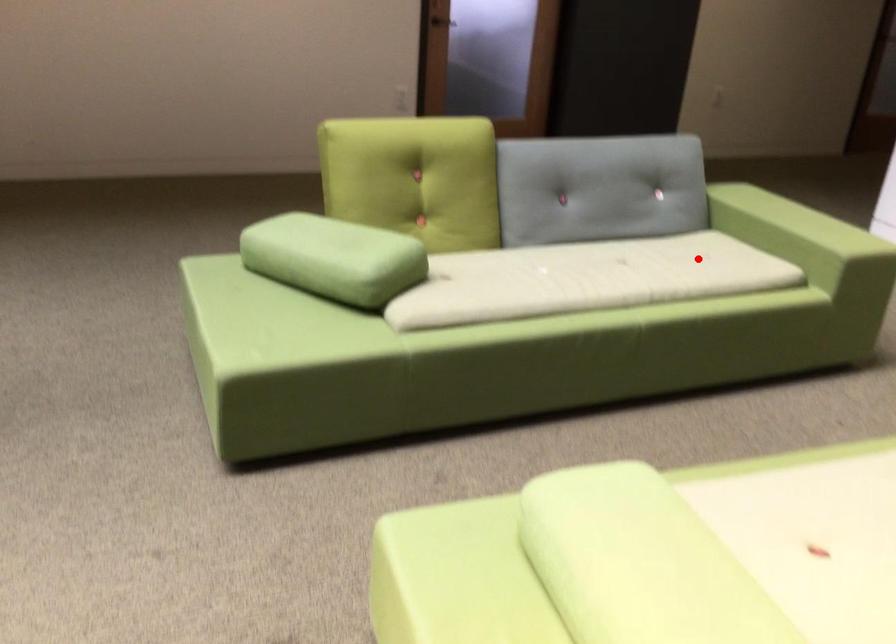
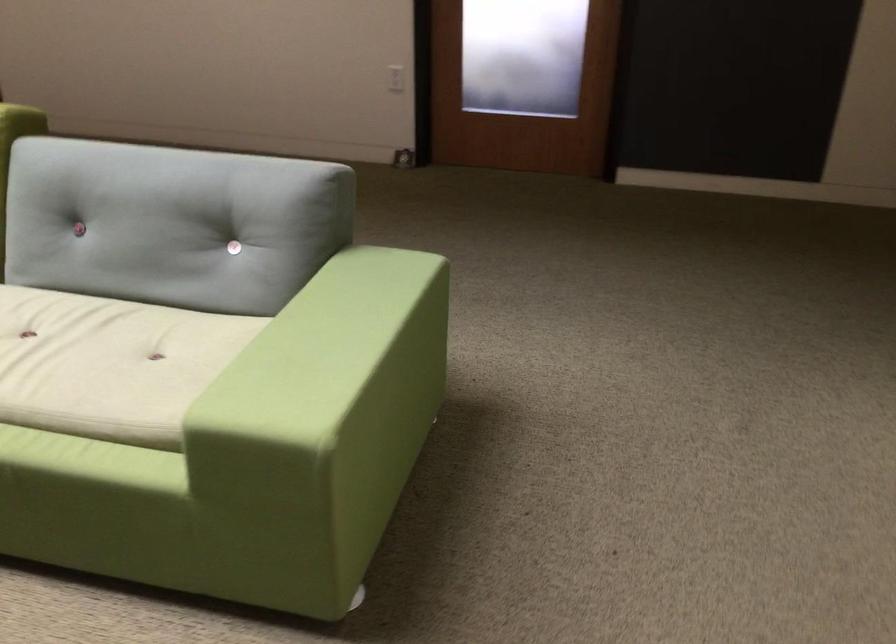
Locate, in the second image, the point that corresponds to the highlighted location in the first image.

(109, 364)